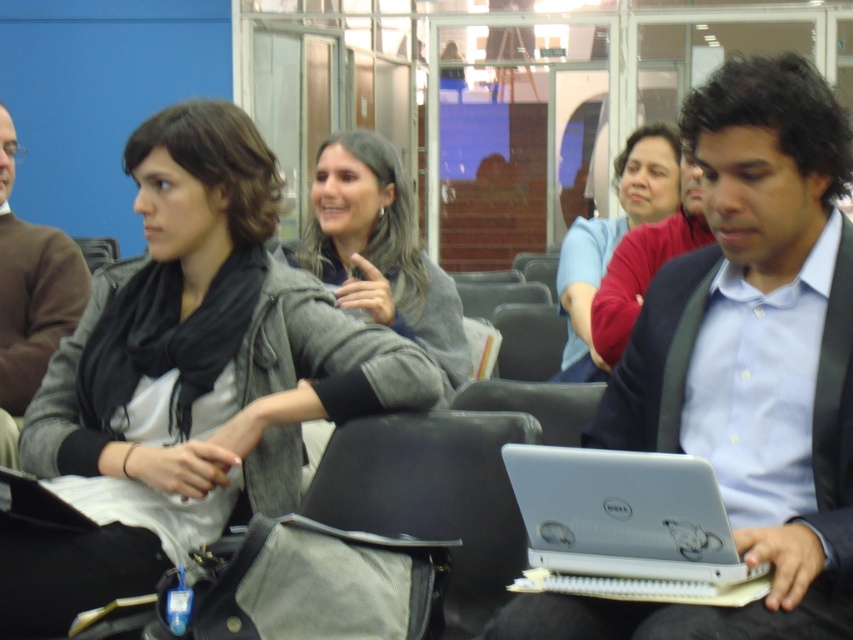
Which is behind, point (717, 348) or point (579, 524)?

The point (717, 348) is more distant.

Can you confirm if matte silver laptop at center is positioned below white matte laptop at lower right?

Incorrect, matte silver laptop at center is not positioned below white matte laptop at lower right.

Between point (820, 572) and point (705, 512), which one is positioned in front?

Point (705, 512) is in front.

The width and height of the screenshot is (853, 640). Find the location of `matte silver laptop at center`. matte silver laptop at center is located at coordinates (746, 364).

Which of these two, matte silver laptop at center or matte red sweater at center, stands shorter?

Standing shorter between the two is matte red sweater at center.

Identify the location of matte silver laptop at center. Image resolution: width=853 pixels, height=640 pixels. (746, 364).

Find the location of a particular element. The image size is (853, 640). matte silver laptop at center is located at coordinates (746, 364).

Consider the image. Can you confirm if white matte laptop at lower right is smaller than gray woolen sweater at center?

Indeed, white matte laptop at lower right has a smaller size compared to gray woolen sweater at center.

Is white matte laptop at lower right thinner than gray woolen sweater at center?

Yes.

Who is more distant from viewer, (711, 560) or (341, 289)?

Positioned behind is point (341, 289).

Image resolution: width=853 pixels, height=640 pixels. I want to click on white matte laptop at lower right, so click(624, 515).